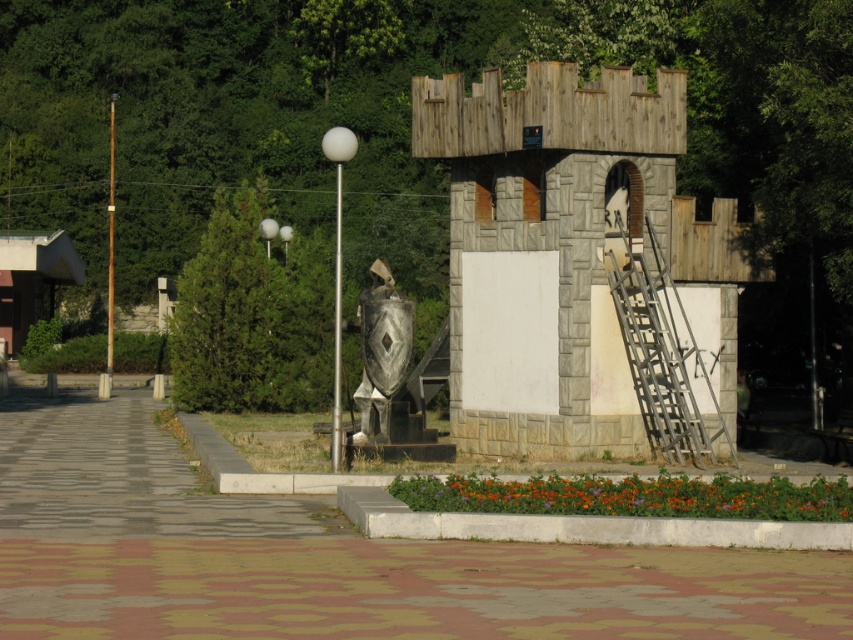
Question: Considering the relative positions of metallic silver ladder at right and metallic silver shield at center in the image provided, where is metallic silver ladder at right located with respect to metallic silver shield at center?

Choices:
 (A) below
 (B) above

Answer: (B)

Question: Which object appears closest to the camera in this image?

Choices:
 (A) metallic silver ladder at right
 (B) metallic silver shield at center

Answer: (B)

Question: Can you confirm if metallic silver ladder at right is wider than metallic silver shield at center?

Choices:
 (A) no
 (B) yes

Answer: (B)

Question: Which of the following is the farthest from the observer?

Choices:
 (A) (651, 269)
 (B) (386, 365)

Answer: (A)

Question: Can you confirm if metallic silver ladder at right is bigger than metallic silver shield at center?

Choices:
 (A) no
 (B) yes

Answer: (B)